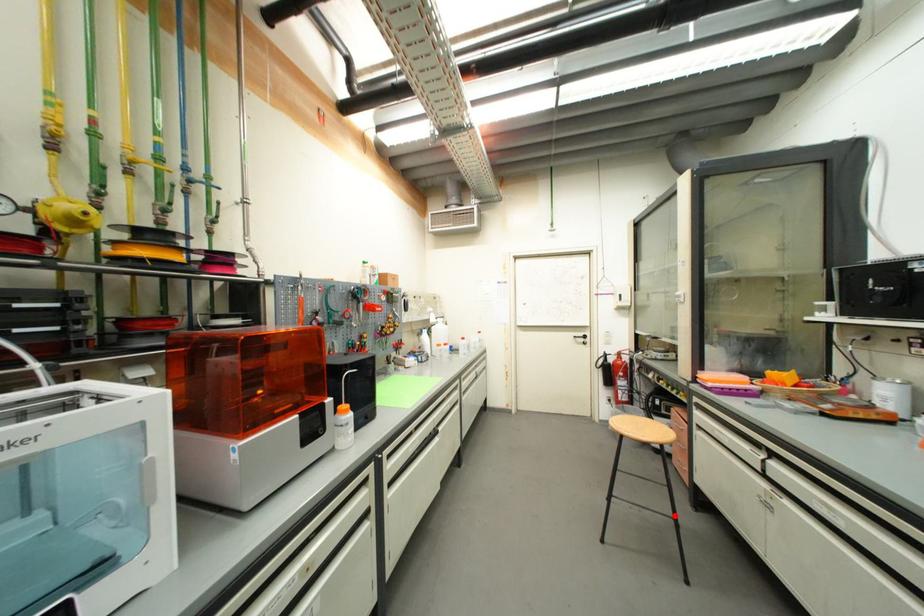
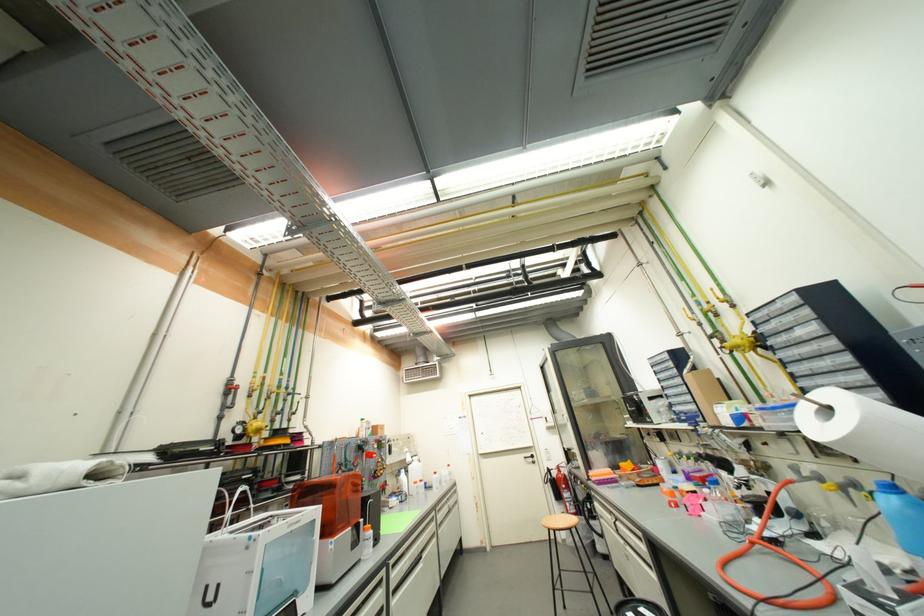
Where in the second image is the point corresponding to the highlighted location from the first image?

(594, 592)